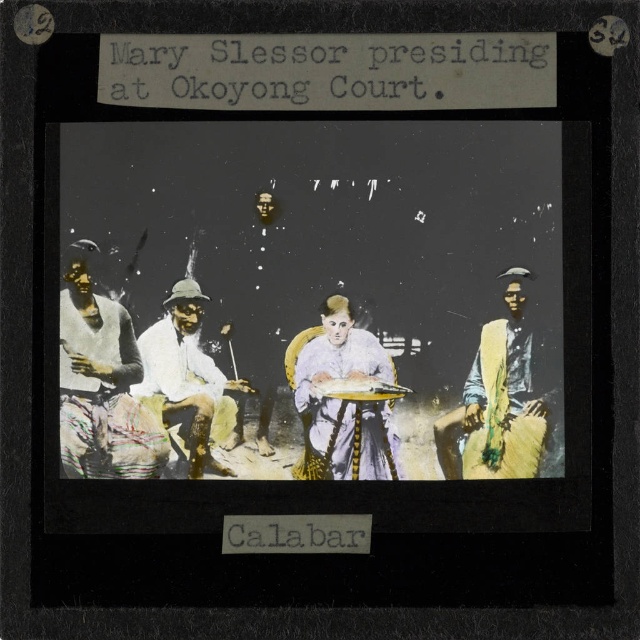
Question: Which point is closer to the camera?

Choices:
 (A) white textured fabric at left
 (B) white silk dress at center

Answer: (A)

Question: Which of the following is the farthest from the observer?

Choices:
 (A) yellow fabric at right
 (B) white textured fabric at left
 (C) white cloth hat at center

Answer: (C)

Question: Is white silk dress at center behind white cloth hat at center?

Choices:
 (A) no
 (B) yes

Answer: (B)

Question: Is white textured fabric at left smaller than yellow fabric at right?

Choices:
 (A) no
 (B) yes

Answer: (A)

Question: Is the position of white textured fabric at left less distant than that of white silk dress at center?

Choices:
 (A) yes
 (B) no

Answer: (A)

Question: Which point is closer to the camera taking this photo?

Choices:
 (A) (106, 349)
 (B) (458, 433)
 (C) (196, 340)
 (D) (353, 364)

Answer: (A)